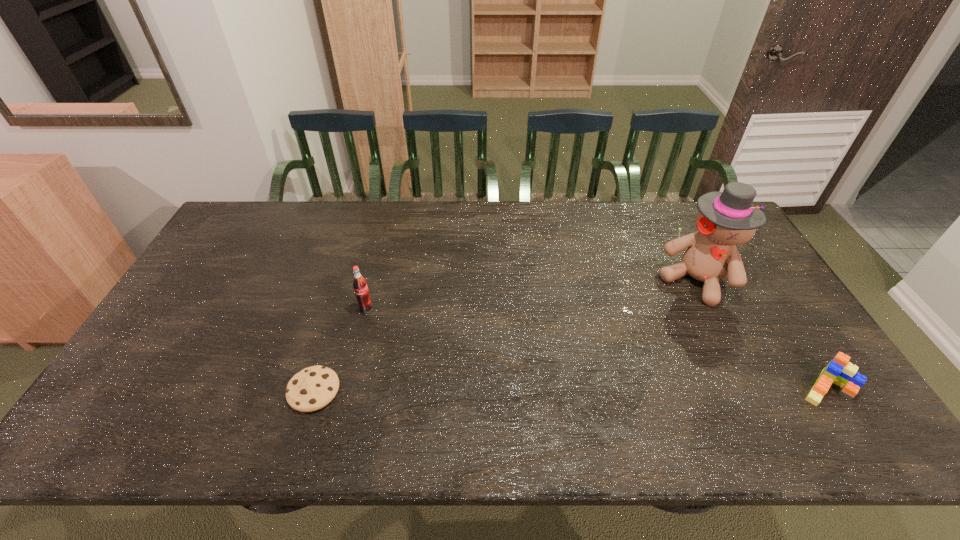
Where is `vacant space located on the front-facing side of the third object from left to right`? vacant space located on the front-facing side of the third object from left to right is located at coordinates (635, 361).

I want to click on vacant area situated on the label of the soda bottle, so click(394, 322).

Image resolution: width=960 pixels, height=540 pixels. In order to click on vacant area situated 0.110m on the label of the soda bottle in this screenshot , I will do `click(401, 327)`.

At what (x,y) coordinates should I click in order to perform the action: click on vacant space situated 0.130m on the label of the soda bottle. Please return your answer as a coordinate pair (x, y). Looking at the image, I should click on (407, 329).

Locate an element on the screen. The width and height of the screenshot is (960, 540). cookie that is at the near edge is located at coordinates (311, 389).

Find the location of `Lego located in the near edge section of the desktop`. Lego located in the near edge section of the desktop is located at coordinates (840, 371).

The image size is (960, 540). What are the coordinates of `Lego that is at the right edge` in the screenshot? It's located at (840, 371).

Image resolution: width=960 pixels, height=540 pixels. In order to click on rag_doll present at the right edge in this screenshot , I will do `click(725, 219)`.

Locate an element on the screen. object that is at the near right corner is located at coordinates (840, 371).

In the image, there is a desktop. Where is `vacant area at the far edge`? The image size is (960, 540). vacant area at the far edge is located at coordinates (571, 218).